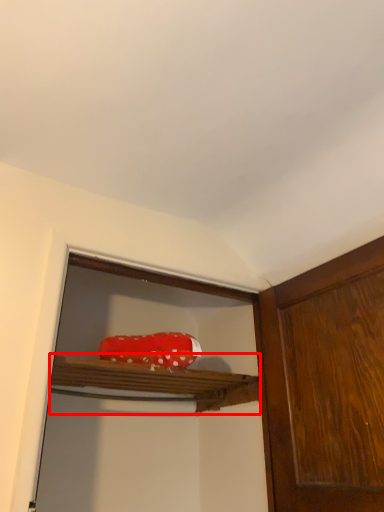
Question: From the image, what is the correct spatial relationship of cabinet (annotated by the red box) in relation to stuff?

Choices:
 (A) right
 (B) left

Answer: (B)